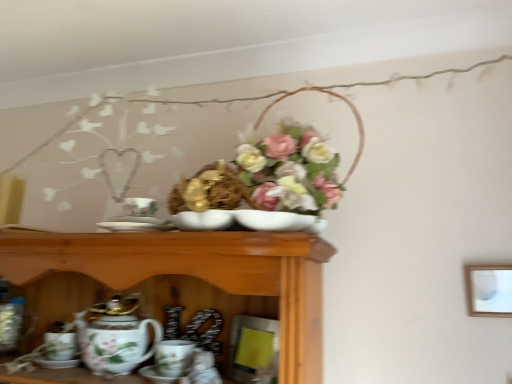
This screenshot has height=384, width=512. Describe the element at coordinates (139, 207) in the screenshot. I see `porcelain plate at center` at that location.

You are a GUI agent. You are given a task and a screenshot of the screen. Output one action in this format:
    pyautogui.click(x=<x>, y=<y>)
    Task: Click on the porcelain coffee cup at lower center
    The width and height of the screenshot is (512, 384).
    Given the screenshot: What is the action you would take?
    pyautogui.click(x=173, y=357)

The image size is (512, 384). I want to click on matte white picture frame at upper right, so click(489, 290).

This screenshot has height=384, width=512. What are the coordinates of `porcelain floral teapot at lower left` in the screenshot? It's located at [x=138, y=346].

Which is more to the left, porcelain coffee cup at lower center or porcelain floral teapot at lower left?

From the viewer's perspective, porcelain floral teapot at lower left appears more on the left side.

Which is behind, point (169, 352) or point (92, 333)?

The point (92, 333) is farther.

Can you confirm if porcelain coffee cup at lower center is taller than porcelain floral teapot at lower left?

Incorrect, the height of porcelain coffee cup at lower center is not larger of that of porcelain floral teapot at lower left.

Who is smaller, porcelain coffee cup at lower center or porcelain floral teapot at lower left?

porcelain coffee cup at lower center is smaller.

Who is smaller, porcelain floral teapot at lower left or matte white picture frame at upper right?

matte white picture frame at upper right is smaller.

Is porcelain floral teapot at lower left not near matte white picture frame at upper right?

porcelain floral teapot at lower left is near matte white picture frame at upper right, not far away.

Which is nearer, (159, 327) or (497, 265)?

Clearly, point (159, 327) is more distant from the camera than point (497, 265).

From the image's perspective, is porcelain floral teapot at lower left positioned above or below matte white picture frame at upper right?

From the image's perspective, porcelain floral teapot at lower left appears below matte white picture frame at upper right.

Measure the distance from porcelain coffee cup at lower center to porcelain plate at center.

The distance of porcelain coffee cup at lower center from porcelain plate at center is 12.93 inches.

The width and height of the screenshot is (512, 384). I want to click on tableware on the left side of porcelain coffee cup at lower center, so click(x=139, y=207).

From a real-world perspective, is porcelain coffee cup at lower center positioned above or below porcelain plate at center?

From a real-world perspective, porcelain coffee cup at lower center is physically below porcelain plate at center.

Between porcelain coffee cup at lower center and porcelain plate at center, which one has smaller size?

With smaller size is porcelain plate at center.

Looking at this image, is porcelain coffee cup at lower center at the back of porcelain floral teapot at lower left?

No.

From a real-world perspective, which is physically below, porcelain floral teapot at lower left or porcelain coffee cup at lower center?

In real-world perspective, porcelain coffee cup at lower center is lower.

Would you say porcelain floral teapot at lower left is to the left or to the right of porcelain coffee cup at lower center in the picture?

In the image, porcelain floral teapot at lower left appears on the left side of porcelain coffee cup at lower center.

Is porcelain floral teapot at lower left taller than porcelain coffee cup at lower center?

Correct, porcelain floral teapot at lower left is much taller as porcelain coffee cup at lower center.

Between matte white picture frame at upper right and porcelain floral teapot at lower left, which one has smaller size?

matte white picture frame at upper right.

Is there a large distance between matte white picture frame at upper right and porcelain floral teapot at lower left?

That's not correct — matte white picture frame at upper right is a little close to porcelain floral teapot at lower left.

In the scene shown: Is matte white picture frame at upper right turned away from porcelain floral teapot at lower left?

matte white picture frame at upper right does not have its back to porcelain floral teapot at lower left.

Is matte white picture frame at upper right spatially inside porcelain floral teapot at lower left, or outside of it?

matte white picture frame at upper right exists outside the volume of porcelain floral teapot at lower left.

Is porcelain plate at center turned away from porcelain coffee cup at lower center?

porcelain plate at center does not have its back to porcelain coffee cup at lower center.

Is porcelain plate at center inside the boundaries of porcelain coffee cup at lower center, or outside?

porcelain plate at center is not enclosed by porcelain coffee cup at lower center.

How many degrees apart are the facing directions of porcelain plate at center and porcelain coffee cup at lower center?

The angle between the facing direction of porcelain plate at center and the facing direction of porcelain coffee cup at lower center is 5.35 degrees.

Based on the photo, which of these two, porcelain plate at center or porcelain coffee cup at lower center, is smaller?

porcelain plate at center is smaller.

Between matte white picture frame at upper right and porcelain plate at center, which one has larger width?

porcelain plate at center.

Is matte white picture frame at upper right facing away from porcelain plate at center?

No, matte white picture frame at upper right's orientation is not away from porcelain plate at center.

The width and height of the screenshot is (512, 384). Identify the location of picture frame on the right side of porcelain plate at center. (489, 290).

From a real-world perspective, is matte white picture frame at upper right located beneath porcelain plate at center?

Yes, from a real-world perspective, matte white picture frame at upper right is under porcelain plate at center.

Locate an element on the screen. Image resolution: width=512 pixels, height=384 pixels. tea set above the porcelain coffee cup at lower center (from the image's perspective) is located at coordinates (138, 346).

Locate an element on the screen. tea set that appears below the matte white picture frame at upper right (from the image's perspective) is located at coordinates (138, 346).

When comparing their distances from porcelain coffee cup at lower center, does porcelain floral teapot at lower left or porcelain plate at center seem closer?

The object closer to porcelain coffee cup at lower center is porcelain floral teapot at lower left.

Considering their positions, is porcelain floral teapot at lower left positioned further to porcelain plate at center than matte white picture frame at upper right?

The object further to porcelain plate at center is matte white picture frame at upper right.

Considering their positions, is porcelain floral teapot at lower left positioned further to matte white picture frame at upper right than porcelain coffee cup at lower center?

porcelain floral teapot at lower left is positioned further to the anchor matte white picture frame at upper right.

Considering their positions, is porcelain plate at center positioned further to porcelain coffee cup at lower center than porcelain floral teapot at lower left?

porcelain plate at center lies further to porcelain coffee cup at lower center than the other object.

Looking at the image, which one is located closer to porcelain plate at center, porcelain coffee cup at lower center or matte white picture frame at upper right?

Among the two, porcelain coffee cup at lower center is located nearer to porcelain plate at center.

Based on their spatial positions, is matte white picture frame at upper right or porcelain plate at center further from porcelain coffee cup at lower center?

matte white picture frame at upper right lies further to porcelain coffee cup at lower center than the other object.

Based on their spatial positions, is porcelain coffee cup at lower center or porcelain plate at center closer to matte white picture frame at upper right?

porcelain coffee cup at lower center is closer to matte white picture frame at upper right.

Based on their spatial positions, is matte white picture frame at upper right or porcelain floral teapot at lower left closer to porcelain coffee cup at lower center?

porcelain floral teapot at lower left lies closer to porcelain coffee cup at lower center than the other object.

At what (x,y) coordinates should I click in order to perform the action: click on tableware located between porcelain floral teapot at lower left and matte white picture frame at upper right in the left-right direction. Please return your answer as a coordinate pair (x, y). The width and height of the screenshot is (512, 384). Looking at the image, I should click on pyautogui.click(x=139, y=207).

This screenshot has width=512, height=384. Identify the location of coffee cup between porcelain floral teapot at lower left and matte white picture frame at upper right from left to right. (173, 357).

What are the coordinates of `tea set between porcelain plate at center and porcelain coffee cup at lower center vertically` in the screenshot? It's located at (138, 346).

In order to click on coffee cup between porcelain plate at center and matte white picture frame at upper right from left to right in this screenshot , I will do `click(173, 357)`.